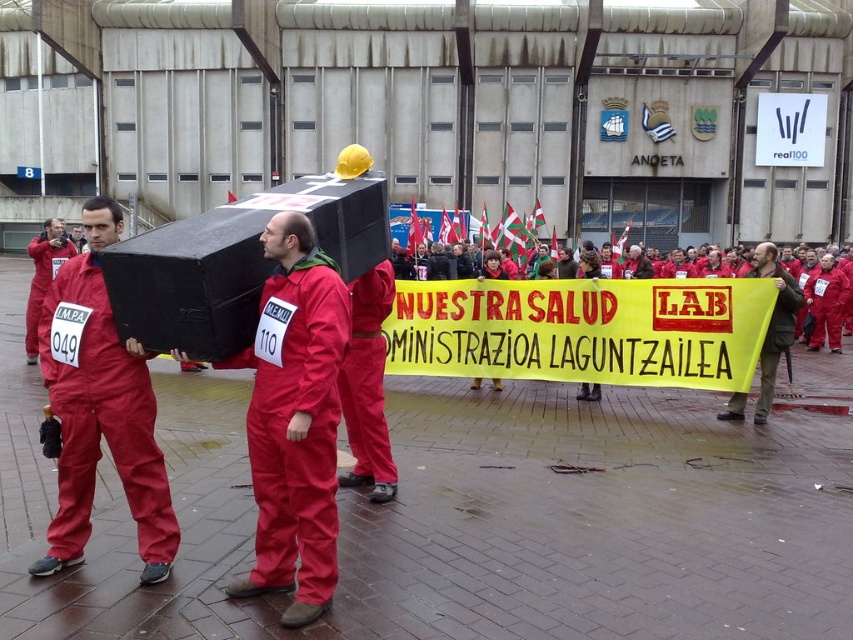
Who is more distant from viewer, (65, 541) or (53, 260)?

Point (53, 260)

Does point (103, 296) come in front of point (62, 234)?

Yes, point (103, 296) is closer to viewer.

Find the location of `matte red jumpsuit at center`. matte red jumpsuit at center is located at coordinates (100, 408).

Between matte red jumpsuit at center and red fabric banner at center, which one has less height?

Standing shorter between the two is matte red jumpsuit at center.

Is matte red jumpsuit at center closer to camera compared to red fabric banner at center?

Yes, matte red jumpsuit at center is in front of red fabric banner at center.

Between point (164, 554) and point (764, 244), which one is positioned in front?

Point (164, 554)

The image size is (853, 640). What are the coordinates of `matte red jumpsuit at center` in the screenshot? It's located at (100, 408).

Does red fabric banner at center have a larger size compared to matte red jumpsuit at left?

No.

Who is more distant from viewer, (764, 244) or (48, 237)?

Point (764, 244)

Where is `red fabric banner at center`? This screenshot has height=640, width=853. red fabric banner at center is located at coordinates (775, 323).